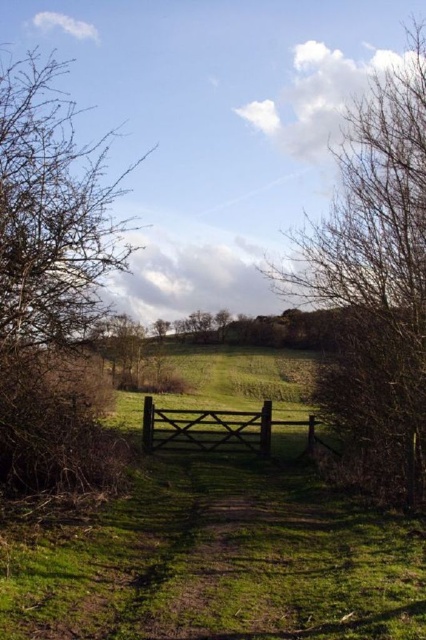
You are standing in a rural area and see the bare branches at left. If you want to get closer to them, should you walk forward or backward?

The bare branches at left are 26.06 feet away from the viewer. To get closer to them, you should walk forward towards the bare branches at left.

You are a painter setting up your easel to capture the rural scene. You want to ensure that the bare branches at left and the bare branches at right are proportionally accurate in your painting. Which of the two should you draw with a narrower width?

The bare branches at left should be drawn with a narrower width since they have a lesser width compared to the bare branches at right according to the description.